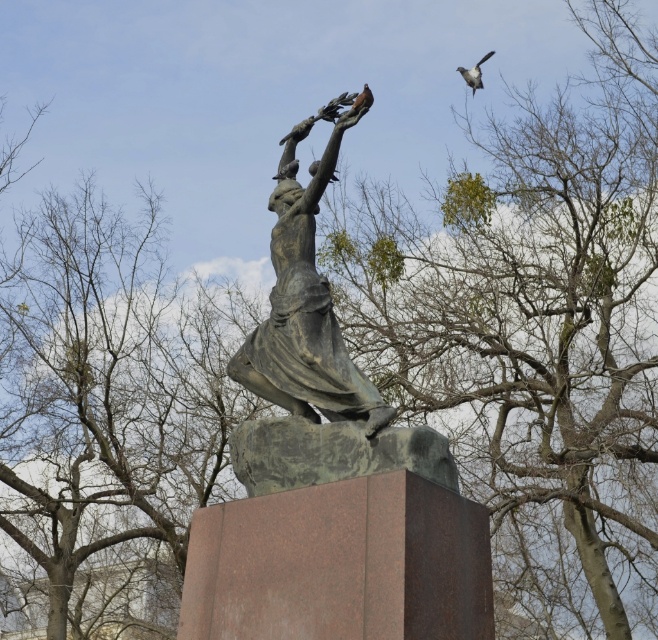
Question: Does green mossy tree at upper center come behind bare branches at center?

Choices:
 (A) no
 (B) yes

Answer: (A)

Question: Does green mossy tree at upper center appear on the right side of gray feathered bird at upper right?

Choices:
 (A) no
 (B) yes

Answer: (B)

Question: Among these points, which one is nearest to the camera?

Choices:
 (A) (297, 364)
 (B) (465, 68)
 (C) (397, 292)

Answer: (A)

Question: Among these objects, which one is nearest to the camera?

Choices:
 (A) gray feathered bird at upper right
 (B) bare branches at center

Answer: (B)

Question: Can you confirm if green mossy tree at upper center is positioned below bronze statue at center?

Choices:
 (A) no
 (B) yes

Answer: (A)

Question: Which of the following is the closest to the observer?

Choices:
 (A) gray feathered bird at upper right
 (B) bronze statue at center
 (C) green mossy tree at upper center

Answer: (B)